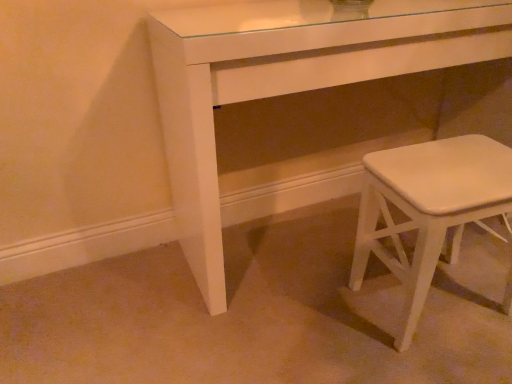
Question: Considering the relative positions of white glossy table at center and white matte stool at lower right in the image provided, is white glossy table at center to the left or to the right of white matte stool at lower right?

Choices:
 (A) right
 (B) left

Answer: (B)

Question: In terms of size, does white glossy table at center appear bigger or smaller than white matte stool at lower right?

Choices:
 (A) big
 (B) small

Answer: (A)

Question: Considering the positions of white glossy table at center and white matte stool at lower right in the image, is white glossy table at center wider or thinner than white matte stool at lower right?

Choices:
 (A) wide
 (B) thin

Answer: (A)

Question: From the image's perspective, is white matte stool at lower right above or below white glossy table at center?

Choices:
 (A) above
 (B) below

Answer: (B)

Question: In terms of height, does white matte stool at lower right look taller or shorter compared to white glossy table at center?

Choices:
 (A) short
 (B) tall

Answer: (A)

Question: Looking at their shapes, would you say white matte stool at lower right is wider or thinner than white glossy table at center?

Choices:
 (A) thin
 (B) wide

Answer: (A)

Question: Is point (422, 213) positioned closer to the camera than point (204, 114)?

Choices:
 (A) farther
 (B) closer

Answer: (B)